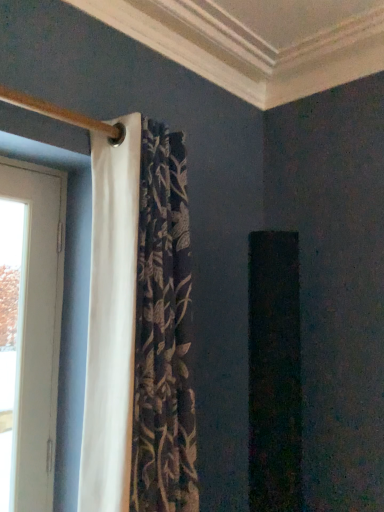
Locate an element on the screen. The width and height of the screenshot is (384, 512). white fabric curtain at left is located at coordinates (139, 327).

Describe the element at coordinates (139, 327) in the screenshot. I see `white fabric curtain at left` at that location.

What do you see at coordinates (29, 334) in the screenshot?
I see `white wood door at left` at bounding box center [29, 334].

Locate an element on the screen. white wood door at left is located at coordinates (29, 334).

Identify the location of white fabric curtain at left. This screenshot has width=384, height=512. (139, 327).

Is white wood door at left to the left or to the right of white fabric curtain at left in the image?

In the image, white wood door at left appears on the left side of white fabric curtain at left.

Considering the positions of objects white wood door at left and white fabric curtain at left in the image provided, who is in front, white wood door at left or white fabric curtain at left?

Positioned in front is white fabric curtain at left.

Considering the positions of points (44, 241) and (173, 511), is point (44, 241) closer to camera compared to point (173, 511)?

That is False.

From the image's perspective, which one is positioned lower, white wood door at left or white fabric curtain at left?

white wood door at left appears lower in the image.

From a real-world perspective, who is located lower, white wood door at left or white fabric curtain at left?

white wood door at left.

In terms of width, does white wood door at left look wider or thinner when compared to white fabric curtain at left?

Considering their sizes, white wood door at left looks slimmer than white fabric curtain at left.

Can you confirm if white wood door at left is shorter than white fabric curtain at left?

Correct, white wood door at left is not as tall as white fabric curtain at left.

Considering the relative sizes of white wood door at left and white fabric curtain at left in the image provided, is white wood door at left bigger than white fabric curtain at left?

No, white wood door at left is not bigger than white fabric curtain at left.

Is white wood door at left spatially inside white fabric curtain at left, or outside of it?

white wood door at left exists outside the volume of white fabric curtain at left.

Can you see white wood door at left touching white fabric curtain at left?

No, white wood door at left is not next to white fabric curtain at left.

Is white wood door at left aimed at white fabric curtain at left?

No, white wood door at left is not turned towards white fabric curtain at left.

How far apart are white wood door at left and white fabric curtain at left?

white wood door at left is 14.70 inches away from white fabric curtain at left.

This screenshot has height=512, width=384. In order to click on door behind the white fabric curtain at left in this screenshot , I will do `click(29, 334)`.

Considering the positions of objects white fabric curtain at left and white wood door at left in the image provided, who is more to the left, white fabric curtain at left or white wood door at left?

From the viewer's perspective, white wood door at left appears more on the left side.

Between white fabric curtain at left and white wood door at left, which one is positioned in front?

Answer: white fabric curtain at left is in front.

Does point (142, 453) appear closer or farther from the camera than point (17, 398)?

Point (142, 453) appears to be closer to the viewer than point (17, 398).

From the image's perspective, does white fabric curtain at left appear lower than white wood door at left?

No, from the image's perspective, white fabric curtain at left is not below white wood door at left.

From a real-world perspective, who is located higher, white fabric curtain at left or white wood door at left?

From a 3D spatial view, white fabric curtain at left is above.

Between white fabric curtain at left and white wood door at left, which one has smaller width?

white wood door at left is thinner.

Who is shorter, white fabric curtain at left or white wood door at left?

white wood door at left.

Between white fabric curtain at left and white wood door at left, which one has smaller size?

Smaller between the two is white wood door at left.

Is white fabric curtain at left inside the boundaries of white wood door at left, or outside?

The correct answer is: outside.

Is white fabric curtain at left not close to white wood door at left?

No.

Looking at this image, is white fabric curtain at left facing away from white wood door at left?

Yes, white fabric curtain at left's orientation is away from white wood door at left.

Can you tell me how much white fabric curtain at left and white wood door at left differ in facing direction?

0.972 degrees.

At what (x,y) coordinates should I click in order to perform the action: click on curtain that is in front of the white wood door at left. Please return your answer as a coordinate pair (x, y). This screenshot has width=384, height=512. Looking at the image, I should click on (139, 327).

I want to click on door on the left side of white fabric curtain at left, so click(29, 334).

The image size is (384, 512). In order to click on door below the white fabric curtain at left (from the image's perspective) in this screenshot , I will do [x=29, y=334].